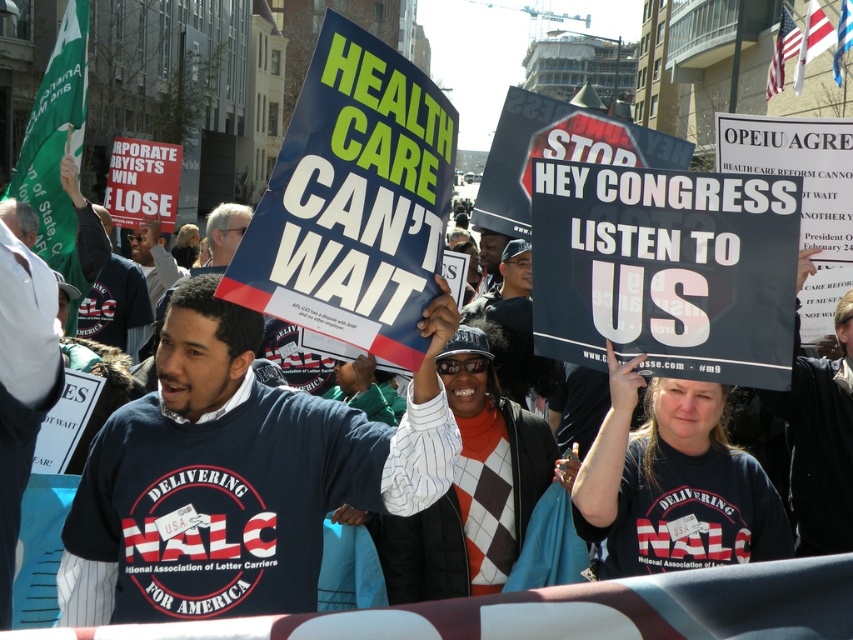
You are a photographer at the protest scene. You want to take a photo that includes both the navy blue shirt at center and the dark blue shirt at center. Which shirt should you focus on first to ensure it is in frame before adjusting the camera angle?

The navy blue shirt at center is much taller than the dark blue shirt at center, so you should focus on the navy blue shirt at center first to ensure it is fully in frame before adjusting the camera angle for the other.

You are a photographer standing at the edge of the protest crowd. You want to take a photo that includes both the central figure holding the large sign and another person near the edge of the crowd. The central figure is at point (169,474) and the other person is at point (131,355). Which of these two points is closer to you?

Point (169,474) is closer to the photographer than point (131,355), so you should focus on capturing the central figure first as they are nearer to your position.

From the picture: You are a photographer standing at the edge of the protest. You want to take a photo that includes both the navy blue shirt at center and the dark blue shirt at center. What is the minimum distance you need to move backward to ensure both are in frame?

The minimum distance you need to move backward is 13.74 meters to ensure both the navy blue shirt at center and the dark blue shirt at center are in frame.